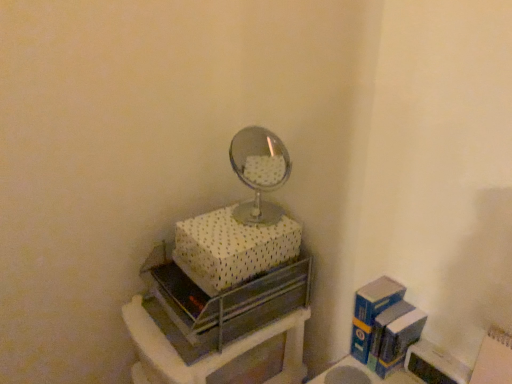
Question: Which direction should I rotate to look at white dotted fabric box at upper center, which is the 1th box from left to right, — up or down?

Choices:
 (A) down
 (B) up

Answer: (A)

Question: Does white dotted fabric box at upper center, which is the 1th box from left to right, appear on the right side of metallic silver drawer at center?

Choices:
 (A) yes
 (B) no

Answer: (A)

Question: Does white dotted fabric box at upper center, the second box in the right-to-left sequence, have a lesser height compared to metallic silver drawer at center?

Choices:
 (A) no
 (B) yes

Answer: (B)

Question: Is white dotted fabric box at upper center, which appears as the second box when ordered from the bottom, positioned with its back to metallic silver drawer at center?

Choices:
 (A) no
 (B) yes

Answer: (A)

Question: Is white dotted fabric box at upper center, the second box in the right-to-left sequence, touching metallic silver drawer at center?

Choices:
 (A) no
 (B) yes

Answer: (A)

Question: From a real-world perspective, is white dotted fabric box at upper center, which appears as the second box when ordered from the bottom, on metallic silver drawer at center?

Choices:
 (A) yes
 (B) no

Answer: (A)

Question: Is white dotted fabric box at upper center, which appears as the second box when ordered from the bottom, positioned in front of metallic silver drawer at center?

Choices:
 (A) no
 (B) yes

Answer: (A)

Question: Is white dotted fabric box at upper center, which is the 1th box from left to right, thinner than blue cardboard box at right, the first box when ordered from right to left?

Choices:
 (A) yes
 (B) no

Answer: (B)

Question: Does white dotted fabric box at upper center, which appears as the second box when ordered from the bottom, have a greater height compared to blue cardboard box at right, the second box from the top?

Choices:
 (A) yes
 (B) no

Answer: (B)

Question: Is white dotted fabric box at upper center, the 1th box from the top, at the right side of blue cardboard box at right, acting as the first box starting from the bottom?

Choices:
 (A) no
 (B) yes

Answer: (A)

Question: Can you confirm if white dotted fabric box at upper center, which is the 1th box from left to right, is shorter than blue cardboard box at right, the first box when ordered from right to left?

Choices:
 (A) no
 (B) yes

Answer: (B)

Question: Is white dotted fabric box at upper center, the 1th box from the top, wider than blue cardboard box at right, the second box from the top?

Choices:
 (A) no
 (B) yes

Answer: (B)

Question: Does white dotted fabric box at upper center, which is the 1th box from left to right, lie behind blue cardboard box at right, acting as the first box starting from the bottom?

Choices:
 (A) yes
 (B) no

Answer: (B)

Question: Is metallic silver drawer at center not near white dotted fabric box at upper center, the 1th box from the top?

Choices:
 (A) yes
 (B) no

Answer: (B)